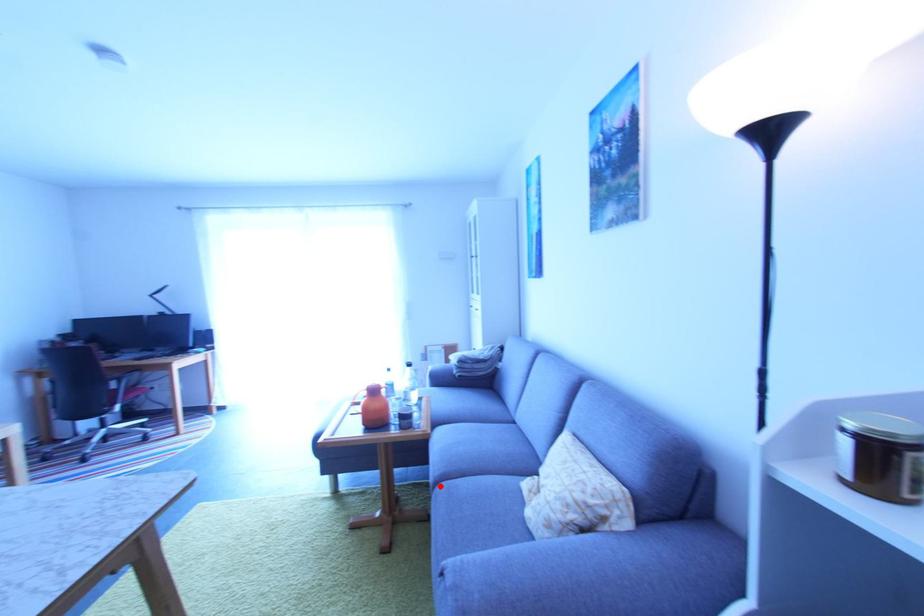
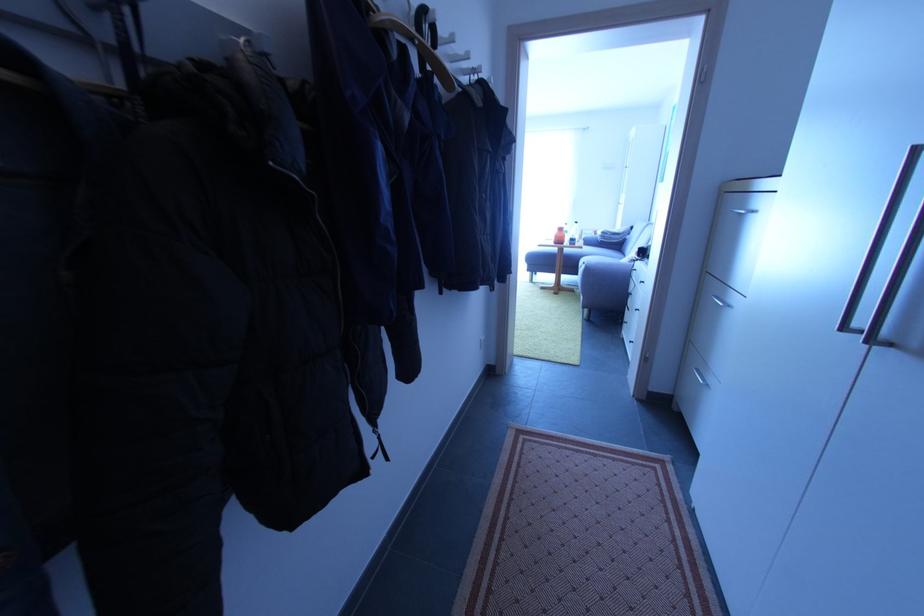
Locate, in the second image, the point that corresponds to the highlighted location in the first image.

(586, 268)